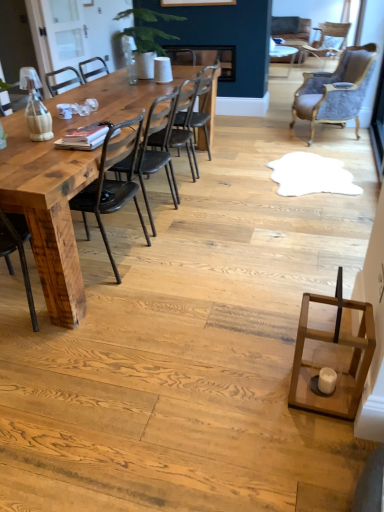
Question: From a real-world perspective, is metallic black chair at center, the fourth chair positioned from the back, physically below natural wood table at left?

Choices:
 (A) yes
 (B) no

Answer: (B)

Question: Would you consider metallic black chair at center, marked as the fourth chair in a top-to-bottom arrangement, to be distant from natural wood table at left?

Choices:
 (A) no
 (B) yes

Answer: (A)

Question: Does metallic black chair at center, the fourth chair positioned from the back, have a lesser width compared to natural wood table at left?

Choices:
 (A) yes
 (B) no

Answer: (A)

Question: Is metallic black chair at center, the fourth chair positioned from the right, closer to the viewer compared to natural wood table at left?

Choices:
 (A) yes
 (B) no

Answer: (B)

Question: Is natural wood table at left at the back of metallic black chair at center, marked as the fourth chair in a top-to-bottom arrangement?

Choices:
 (A) no
 (B) yes

Answer: (B)

Question: Is natural wood table at left inside metallic black chair at center, the fourth chair positioned from the right?

Choices:
 (A) yes
 (B) no

Answer: (B)

Question: Considering the relative positions of metallic black chair at center, the 2th chair when ordered from left to right, and black leather chair at center, the third chair in the left-to-right sequence, in the image provided, is metallic black chair at center, the 2th chair when ordered from left to right, behind black leather chair at center, the third chair in the left-to-right sequence,?

Choices:
 (A) yes
 (B) no

Answer: (B)

Question: Is metallic black chair at center, the fourth chair positioned from the back, thinner than black leather chair at center, arranged as the 3th chair when ordered from the bottom?

Choices:
 (A) no
 (B) yes

Answer: (B)

Question: Is metallic black chair at center, the fourth chair positioned from the back, far away from black leather chair at center, arranged as the 3th chair when ordered from the bottom?

Choices:
 (A) yes
 (B) no

Answer: (B)

Question: From the image's perspective, is metallic black chair at center, the second chair viewed from the front, located beneath black leather chair at center, the third chair when ordered from top to bottom?

Choices:
 (A) no
 (B) yes

Answer: (B)

Question: From a real-world perspective, is metallic black chair at center, the 2th chair from the bottom, positioned over black leather chair at center, placed as the third chair when sorted from back to front, based on gravity?

Choices:
 (A) no
 (B) yes

Answer: (A)

Question: From the image's perspective, is metallic black chair at center, the 2th chair when ordered from left to right, on black leather chair at center, arranged as the 3th chair when ordered from the bottom?

Choices:
 (A) no
 (B) yes

Answer: (A)

Question: Considering the relative sizes of black leather chair at center, placed as the third chair when sorted from back to front, and velvet grey armchair at upper right, placed as the 2th chair when sorted from back to front, in the image provided, is black leather chair at center, placed as the third chair when sorted from back to front, thinner than velvet grey armchair at upper right, placed as the 2th chair when sorted from back to front,?

Choices:
 (A) no
 (B) yes

Answer: (B)